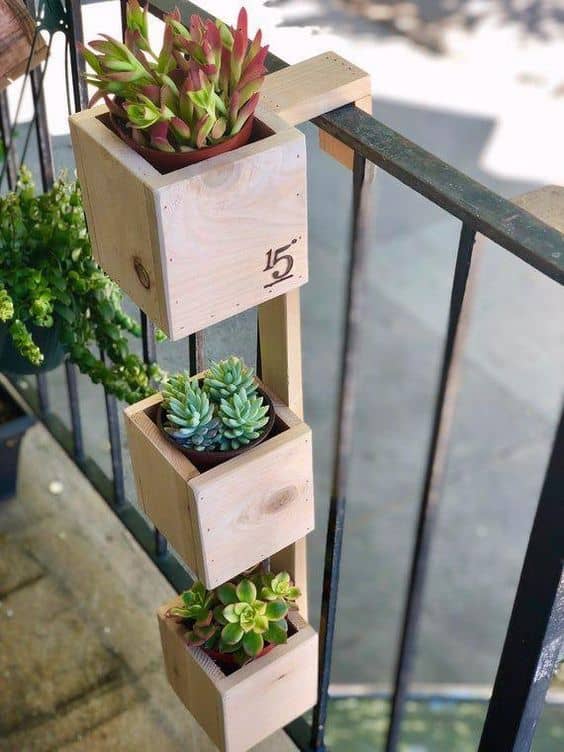
I want to click on wooden planter, so click(217, 505).